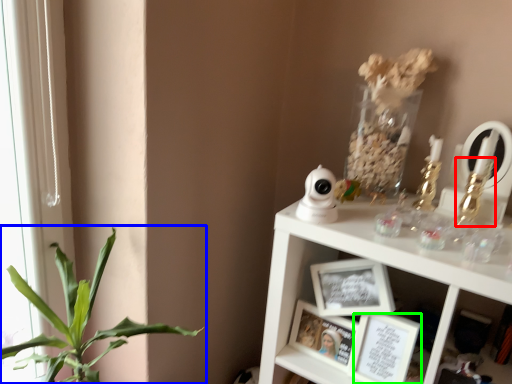
Question: Which is farther away from toy (highlighted by a red box)? houseplant (highlighted by a blue box) or picture frame (highlighted by a green box)?

Choices:
 (A) houseplant
 (B) picture frame

Answer: (A)